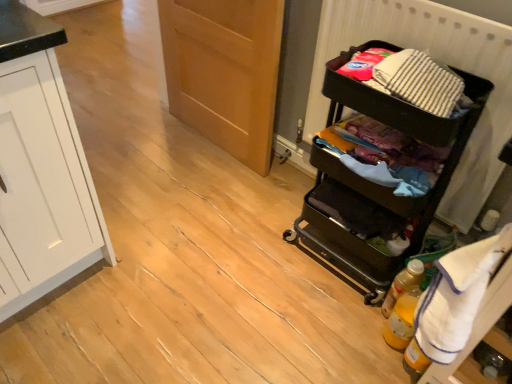
What are the coordinates of `free space above black plastic cart at right (from a real-world perspective)` in the screenshot? It's located at (411, 78).